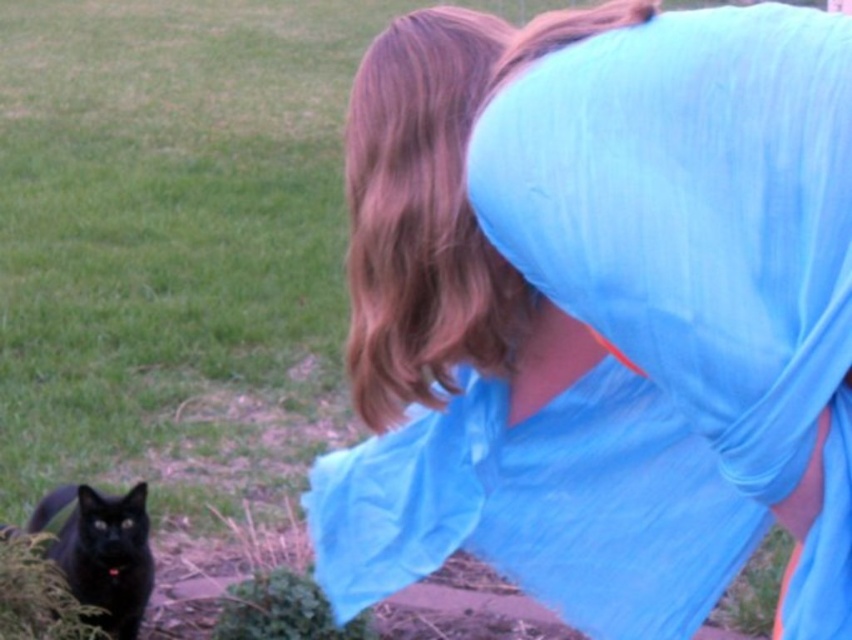
Which of these two, blue fabric shirt at center or shiny black cat at lower left, stands shorter?

With less height is shiny black cat at lower left.

Can you confirm if blue fabric shirt at center is wider than shiny black cat at lower left?

Yes, blue fabric shirt at center is wider than shiny black cat at lower left.

Where is `blue fabric shirt at center`? This screenshot has width=852, height=640. blue fabric shirt at center is located at coordinates (599, 310).